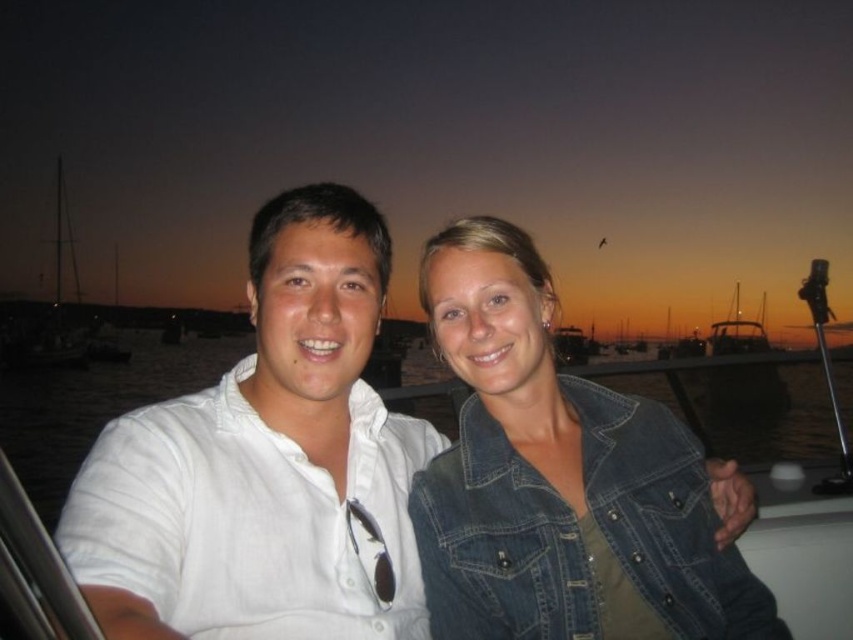
Question: Which point is farther to the camera?

Choices:
 (A) white matte water at center
 (B) denim jacket at center

Answer: (A)

Question: Is white cotton shirt at center to the right of white matte water at center from the viewer's perspective?

Choices:
 (A) no
 (B) yes

Answer: (B)

Question: Does white cotton shirt at center lie in front of denim jacket at center?

Choices:
 (A) yes
 (B) no

Answer: (A)

Question: Which point is farther to the camera?

Choices:
 (A) white cotton shirt at center
 (B) denim jacket at center

Answer: (B)

Question: Does white cotton shirt at center lie in front of white matte water at center?

Choices:
 (A) no
 (B) yes

Answer: (B)

Question: Which point appears farthest from the camera in this image?

Choices:
 (A) (325, 612)
 (B) (538, 481)

Answer: (B)